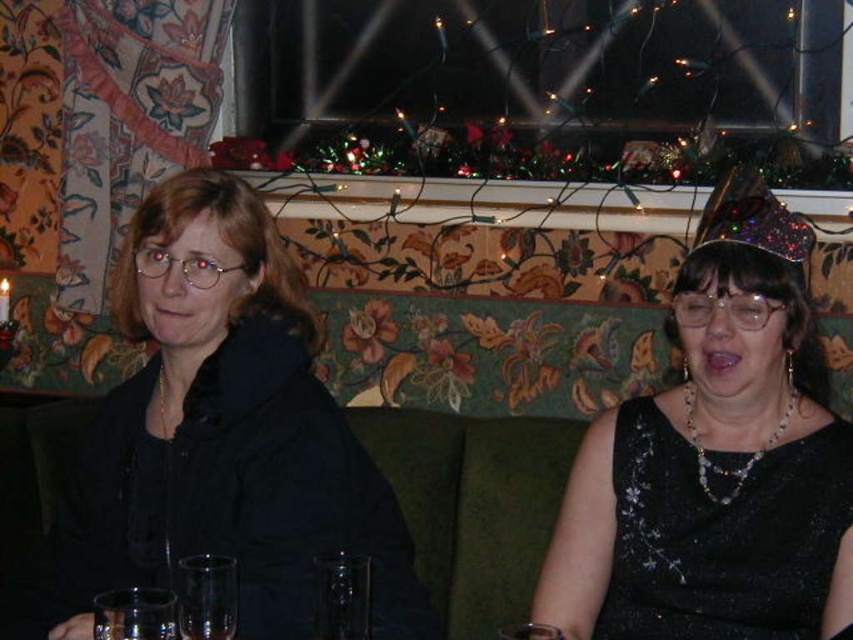
Question: Which point is farther to the camera?

Choices:
 (A) clear glass wine glass at lower left
 (B) clear glass wine glass at lower center
 (C) transparent glass at center
 (D) black sequined dress at center

Answer: (D)

Question: Does black matte jacket at left have a smaller size compared to clear glass wine glass at lower center?

Choices:
 (A) yes
 (B) no

Answer: (B)

Question: Which object is farther from the camera taking this photo?

Choices:
 (A) transparent glass at center
 (B) clear glass at lower center

Answer: (B)

Question: Estimate the real-world distances between objects in this image. Which object is closer to the clear glass at lower center?

Choices:
 (A) clear glass wine glass at lower center
 (B) clear glass wine glass at lower left
 (C) black matte jacket at left

Answer: (B)

Question: From the image, what is the correct spatial relationship of black matte jacket at left in relation to clear glass wine glass at lower center?

Choices:
 (A) left
 (B) right

Answer: (A)

Question: Can you confirm if black matte jacket at left is thinner than black sequined dress at center?

Choices:
 (A) no
 (B) yes

Answer: (A)